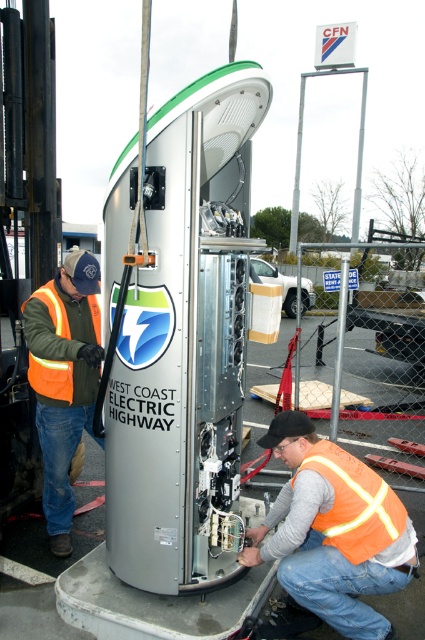
Between hi-visibility reflective safety vest at left and orange reflective safety vest at lower center, which one has less height?

orange reflective safety vest at lower center is shorter.

You are a GUI agent. You are given a task and a screenshot of the screen. Output one action in this format:
    pyautogui.click(x=<x>, y=<y>)
    Task: Click on the hi-visibility reflective safety vest at left
    The height and width of the screenshot is (640, 425).
    Given the screenshot: What is the action you would take?
    pyautogui.click(x=61, y=346)

The width and height of the screenshot is (425, 640). What are the coordinates of `hi-visibility reflective safety vest at left` in the screenshot? It's located at pyautogui.click(x=61, y=346).

Can you confirm if orange reflective vest at lower center is thinner than hi-visibility reflective safety vest at left?

No.

Between orange reflective vest at lower center and hi-visibility reflective safety vest at left, which one has more height?

orange reflective vest at lower center is taller.

Measure the distance between orange reflective vest at lower center and camera.

A distance of 8.06 feet exists between orange reflective vest at lower center and camera.

Identify the location of orange reflective vest at lower center. This screenshot has height=640, width=425. (333, 531).

Between orange reflective vest at lower center and orange reflective vest at left, which one is positioned higher?

orange reflective vest at left is higher up.

Can you confirm if orange reflective vest at lower center is positioned to the right of orange reflective vest at left?

Correct, you'll find orange reflective vest at lower center to the right of orange reflective vest at left.

Is point (413, 552) positioned behind point (61, 483)?

No, (413, 552) is in front of (61, 483).

Locate an element on the screen. This screenshot has height=640, width=425. orange reflective vest at lower center is located at coordinates (333, 531).